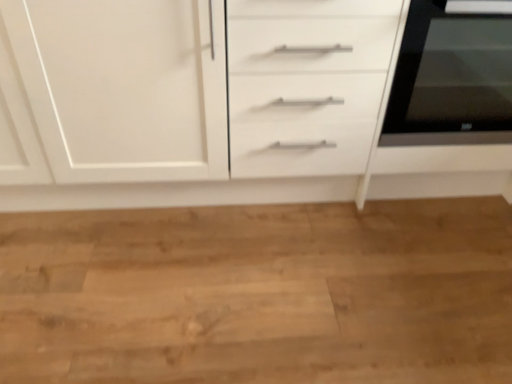
Question: Is black glass oven at right taller or shorter than white matte cabinet at center?

Choices:
 (A) short
 (B) tall

Answer: (A)

Question: Does point (500, 97) appear closer or farther from the camera than point (28, 145)?

Choices:
 (A) closer
 (B) farther

Answer: (A)

Question: From a real-world perspective, is black glass oven at right physically located above or below white matte cabinet at center?

Choices:
 (A) above
 (B) below

Answer: (A)

Question: Is white matte cabinet at center to the left or to the right of black glass oven at right in the image?

Choices:
 (A) left
 (B) right

Answer: (A)

Question: Does point (178, 125) appear closer or farther from the camera than point (488, 69)?

Choices:
 (A) closer
 (B) farther

Answer: (B)

Question: In terms of size, does white matte cabinet at center appear bigger or smaller than black glass oven at right?

Choices:
 (A) small
 (B) big

Answer: (B)

Question: Is white matte cabinet at center inside the boundaries of black glass oven at right, or outside?

Choices:
 (A) inside
 (B) outside

Answer: (B)